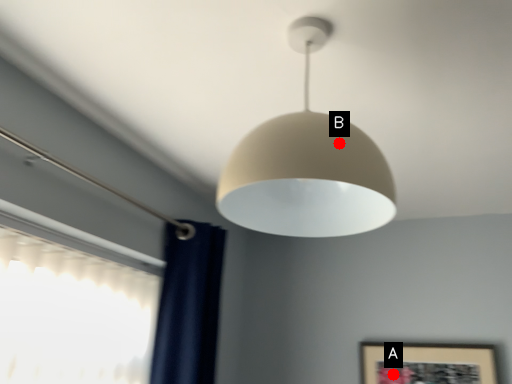
Question: Two points are circled on the image, labeled by A and B beside each circle. Which point is further to the camera?

Choices:
 (A) A is further
 (B) B is further

Answer: (A)